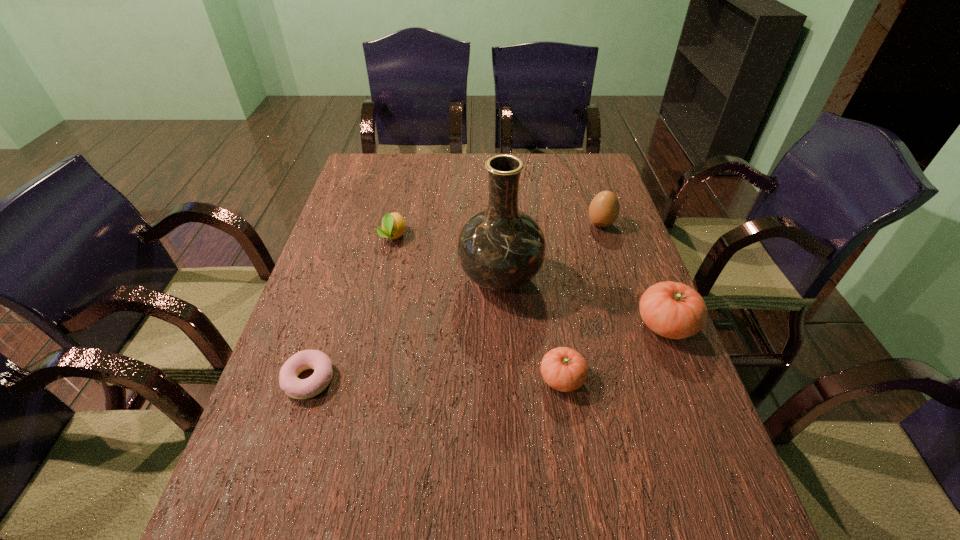
Find the location of a particular element. empty location between the tallest object and the nearer tomato is located at coordinates (531, 329).

Where is `object that is the fifth closest one to the leftmost object`? object that is the fifth closest one to the leftmost object is located at coordinates (604, 209).

This screenshot has width=960, height=540. Find the location of `object that can be found as the fourth closest to the leftmost object`. object that can be found as the fourth closest to the leftmost object is located at coordinates (674, 310).

Where is `free space that satisfies the following two spatial constraints: 1. on the front side of the boiled egg; 2. on the right side of the right tomato`? Image resolution: width=960 pixels, height=540 pixels. free space that satisfies the following two spatial constraints: 1. on the front side of the boiled egg; 2. on the right side of the right tomato is located at coordinates (634, 325).

What are the coordinates of `free region that satisfies the following two spatial constraints: 1. on the front side of the left tomato; 2. on the right side of the vase` in the screenshot? It's located at (505, 379).

Identify the location of vacant region that satisfies the following two spatial constraints: 1. on the back side of the tallest object; 2. on the left side of the doughnut. The height and width of the screenshot is (540, 960). (342, 279).